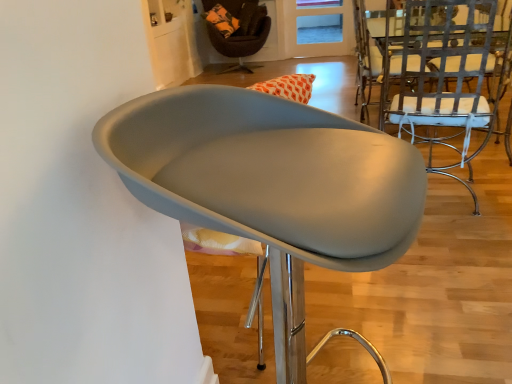
Image resolution: width=512 pixels, height=384 pixels. What do you see at coordinates (313, 43) in the screenshot? I see `translucent orange glass door at upper center` at bounding box center [313, 43].

What are the coordinates of `translucent orange glass door at upper center` in the screenshot? It's located at (313, 43).

Is velvet brown armchair at upper center, positioned as the 1th chair in top-to-bottom order, smaller than metallic silver chair at right, marked as the 2th chair in a front-to-back arrangement?

No, velvet brown armchair at upper center, positioned as the 1th chair in top-to-bottom order, is not smaller than metallic silver chair at right, marked as the 2th chair in a front-to-back arrangement.

Is velvet brown armchair at upper center, placed as the first chair when sorted from back to front, situated inside metallic silver chair at right, which ranks as the 2th chair in back-to-front order, or outside?

velvet brown armchair at upper center, placed as the first chair when sorted from back to front, is spatially situated outside metallic silver chair at right, which ranks as the 2th chair in back-to-front order.

Visually, is velvet brown armchair at upper center, marked as the 3th chair in a bottom-to-top arrangement, positioned to the left or to the right of metallic silver chair at right, marked as the 2th chair in a front-to-back arrangement?

From the image, it's evident that velvet brown armchair at upper center, marked as the 3th chair in a bottom-to-top arrangement, is to the left of metallic silver chair at right, marked as the 2th chair in a front-to-back arrangement.

Who is shorter, velvet brown armchair at upper center, placed as the first chair when sorted from back to front, or metallic silver chair at right, which is counted as the 3th chair, starting from the left?

velvet brown armchair at upper center, placed as the first chair when sorted from back to front, is shorter.

Does matte gray chair at center, the second chair viewed from the right, contain velvet brown armchair at upper center, positioned as the 1th chair in top-to-bottom order?

No, velvet brown armchair at upper center, positioned as the 1th chair in top-to-bottom order, is not surrounded by matte gray chair at center, the second chair viewed from the right.

Between matte gray chair at center, marked as the first chair in a bottom-to-top arrangement, and velvet brown armchair at upper center, positioned as the 1th chair in top-to-bottom order, which one has larger width?

With larger width is velvet brown armchair at upper center, positioned as the 1th chair in top-to-bottom order.

From the image's perspective, between matte gray chair at center, the first chair positioned from the front, and velvet brown armchair at upper center, which ranks as the 3th chair in front-to-back order, who is located below?

matte gray chair at center, the first chair positioned from the front, appears lower in the image.

Is point (402, 183) more distant than point (236, 56)?

No, (402, 183) is in front of (236, 56).

Is velvet brown armchair at upper center, positioned as the 1th chair in top-to-bottom order, placed right next to translucent orange glass door at upper center?

There is a gap between velvet brown armchair at upper center, positioned as the 1th chair in top-to-bottom order, and translucent orange glass door at upper center.

How different are the orientations of velvet brown armchair at upper center, which ranks as the 3th chair in front-to-back order, and translucent orange glass door at upper center in degrees?

velvet brown armchair at upper center, which ranks as the 3th chair in front-to-back order, and translucent orange glass door at upper center are facing 15.6 degrees away from each other.

Is velvet brown armchair at upper center, acting as the 1th chair starting from the left, behind translucent orange glass door at upper center?

No, it is in front of translucent orange glass door at upper center.

Does point (232, 34) lie in front of point (342, 42)?

Yes, point (232, 34) is in front of point (342, 42).

Is metallic silver chair at right, which is counted as the 3th chair, starting from the left, shorter than translucent orange glass door at upper center?

Incorrect, the height of metallic silver chair at right, which is counted as the 3th chair, starting from the left, does not fall short of that of translucent orange glass door at upper center.

Which of these two, metallic silver chair at right, marked as the 2th chair in a front-to-back arrangement, or translucent orange glass door at upper center, is wider?

metallic silver chair at right, marked as the 2th chair in a front-to-back arrangement, is wider.

Relative to translucent orange glass door at upper center, is metallic silver chair at right, the second chair viewed from the top, in front or behind?

Visually, metallic silver chair at right, the second chair viewed from the top, is located in front of translucent orange glass door at upper center.

Is metallic silver chair at right, the second chair viewed from the top, not near translucent orange glass door at upper center?

Indeed, metallic silver chair at right, the second chair viewed from the top, is not near translucent orange glass door at upper center.

Consider the image. Which of these two, velvet brown armchair at upper center, acting as the 1th chair starting from the left, or matte gray chair at center, marked as the first chair in a bottom-to-top arrangement, stands taller?

With more height is matte gray chair at center, marked as the first chair in a bottom-to-top arrangement.

Considering the sizes of objects velvet brown armchair at upper center, positioned as the 1th chair in top-to-bottom order, and matte gray chair at center, the third chair viewed from the back, in the image provided, who is smaller, velvet brown armchair at upper center, positioned as the 1th chair in top-to-bottom order, or matte gray chair at center, the third chair viewed from the back,?

Smaller between the two is matte gray chair at center, the third chair viewed from the back.

What's the angular difference between velvet brown armchair at upper center, marked as the 3th chair in a bottom-to-top arrangement, and matte gray chair at center, the first chair positioned from the front,'s facing directions?

There is a 59.2-degree angle between the facing directions of velvet brown armchair at upper center, marked as the 3th chair in a bottom-to-top arrangement, and matte gray chair at center, the first chair positioned from the front.

Locate an element on the screen. the 2nd chair above the matte gray chair at center, the second chair viewed from the right (from the image's perspective) is located at coordinates (239, 30).

Is translucent orange glass door at upper center oriented towards matte gray chair at center, marked as the first chair in a bottom-to-top arrangement?

Yes.

Would you say translucent orange glass door at upper center contains matte gray chair at center, the second chair viewed from the right?

That's incorrect, matte gray chair at center, the second chair viewed from the right, is not inside translucent orange glass door at upper center.

Can you confirm if translucent orange glass door at upper center is wider than matte gray chair at center, the third chair viewed from the back?

No, translucent orange glass door at upper center is not wider than matte gray chair at center, the third chair viewed from the back.

Is translucent orange glass door at upper center taller than matte gray chair at center, marked as the first chair in a bottom-to-top arrangement?

No.

From a real-world perspective, does metallic silver chair at right, which is counted as the 1th chair, starting from the right, sit lower than velvet brown armchair at upper center, placed as the first chair when sorted from back to front?

Incorrect, from a real-world perspective, metallic silver chair at right, which is counted as the 1th chair, starting from the right, is higher than velvet brown armchair at upper center, placed as the first chair when sorted from back to front.

From the image's perspective, which is above, metallic silver chair at right, which is counted as the 3th chair, starting from the left, or velvet brown armchair at upper center, marked as the 3th chair in a bottom-to-top arrangement?

velvet brown armchair at upper center, marked as the 3th chair in a bottom-to-top arrangement, is shown above in the image.

Is metallic silver chair at right, the second chair viewed from the top, positioned with its back to velvet brown armchair at upper center, positioned as the 1th chair in top-to-bottom order?

No, metallic silver chair at right, the second chair viewed from the top, is not facing away from velvet brown armchair at upper center, positioned as the 1th chair in top-to-bottom order.

At what (x,y) coordinates should I click in order to perform the action: click on chair located above the metallic silver chair at right, the second chair viewed from the top (from the image's perspective). Please return your answer as a coordinate pair (x, y). Looking at the image, I should click on (239, 30).

The height and width of the screenshot is (384, 512). Find the location of `the 2nd chair below when counting from the velvet brown armchair at upper center, marked as the 3th chair in a bottom-to-top arrangement (from the image's perspective)`. the 2nd chair below when counting from the velvet brown armchair at upper center, marked as the 3th chair in a bottom-to-top arrangement (from the image's perspective) is located at coordinates tap(271, 185).

Considering their positions, is metallic silver chair at right, the second chair from the bottom, positioned further to velvet brown armchair at upper center, marked as the 3th chair in a right-to-left arrangement, than matte gray chair at center, which is the 2th chair in left-to-right order?

matte gray chair at center, which is the 2th chair in left-to-right order, is positioned further to the anchor velvet brown armchair at upper center, marked as the 3th chair in a right-to-left arrangement.

When comparing their distances from matte gray chair at center, marked as the first chair in a bottom-to-top arrangement, does metallic silver chair at right, which ranks as the 2th chair in back-to-front order, or translucent orange glass door at upper center seem further?

Among the two, translucent orange glass door at upper center is located further to matte gray chair at center, marked as the first chair in a bottom-to-top arrangement.

Based on their spatial positions, is translucent orange glass door at upper center or metallic silver chair at right, which ranks as the 2th chair in back-to-front order, closer to matte gray chair at center, which is the 2th chair in left-to-right order?

The object closer to matte gray chair at center, which is the 2th chair in left-to-right order, is metallic silver chair at right, which ranks as the 2th chair in back-to-front order.

From the picture: Estimate the real-world distances between objects in this image. Which object is closer to velvet brown armchair at upper center, positioned as the 1th chair in top-to-bottom order, metallic silver chair at right, marked as the 2th chair in a front-to-back arrangement, or translucent orange glass door at upper center?

translucent orange glass door at upper center lies closer to velvet brown armchair at upper center, positioned as the 1th chair in top-to-bottom order, than the other object.

Looking at the image, which one is located closer to translucent orange glass door at upper center, metallic silver chair at right, which ranks as the 2th chair in back-to-front order, or matte gray chair at center, the first chair positioned from the front?

Based on the image, metallic silver chair at right, which ranks as the 2th chair in back-to-front order, appears to be nearer to translucent orange glass door at upper center.

Considering their positions, is metallic silver chair at right, which is counted as the 1th chair, starting from the right, positioned closer to matte gray chair at center, the third chair viewed from the back, than velvet brown armchair at upper center, which ranks as the 3th chair in front-to-back order?

metallic silver chair at right, which is counted as the 1th chair, starting from the right, is positioned closer to the anchor matte gray chair at center, the third chair viewed from the back.

Looking at the image, which one is located closer to matte gray chair at center, the third chair viewed from the back, velvet brown armchair at upper center, marked as the 3th chair in a right-to-left arrangement, or translucent orange glass door at upper center?

The object closer to matte gray chair at center, the third chair viewed from the back, is velvet brown armchair at upper center, marked as the 3th chair in a right-to-left arrangement.

Based on their spatial positions, is matte gray chair at center, which is the 2th chair in left-to-right order, or metallic silver chair at right, the second chair from the bottom, further from translucent orange glass door at upper center?

matte gray chair at center, which is the 2th chair in left-to-right order, is positioned further to the anchor translucent orange glass door at upper center.

You are a GUI agent. You are given a task and a screenshot of the screen. Output one action in this format:
    pyautogui.click(x=<x>, y=<y>)
    Task: Click on the chair between metallic silver chair at right, which is counted as the 3th chair, starting from the left, and translucent orange glass door at upper center from front to back
    The width and height of the screenshot is (512, 384).
    Given the screenshot: What is the action you would take?
    pyautogui.click(x=239, y=30)

Locate an element on the screen. chair between matte gray chair at center, the first chair positioned from the front, and velvet brown armchair at upper center, marked as the 3th chair in a bottom-to-top arrangement, along the z-axis is located at coordinates (441, 73).